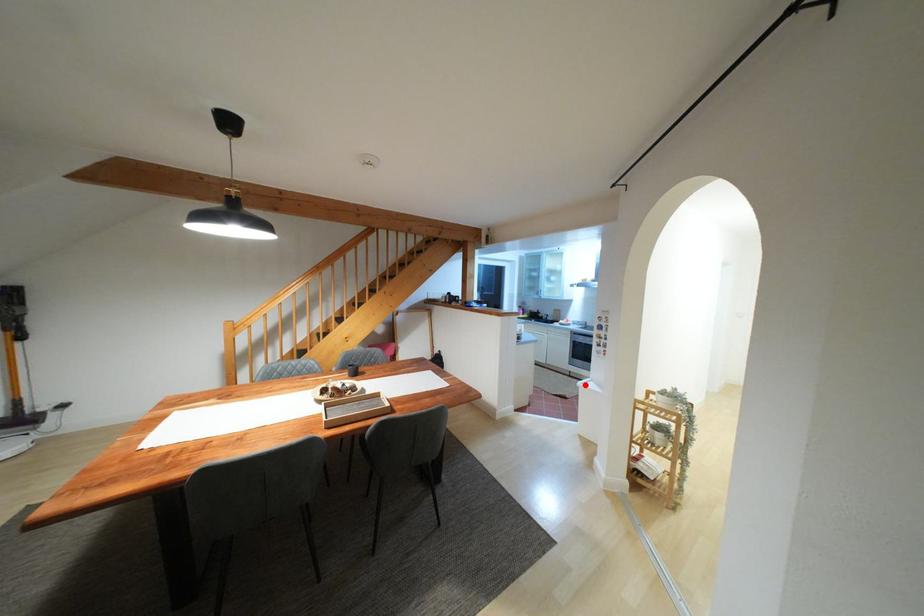
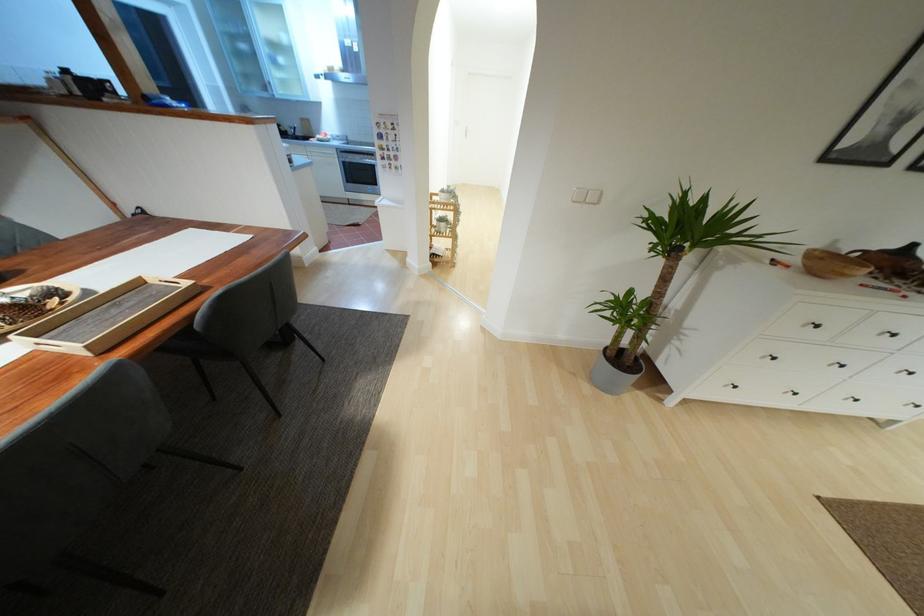
Where in the second image is the point corresponding to the highlighted location from the first image?

(382, 203)